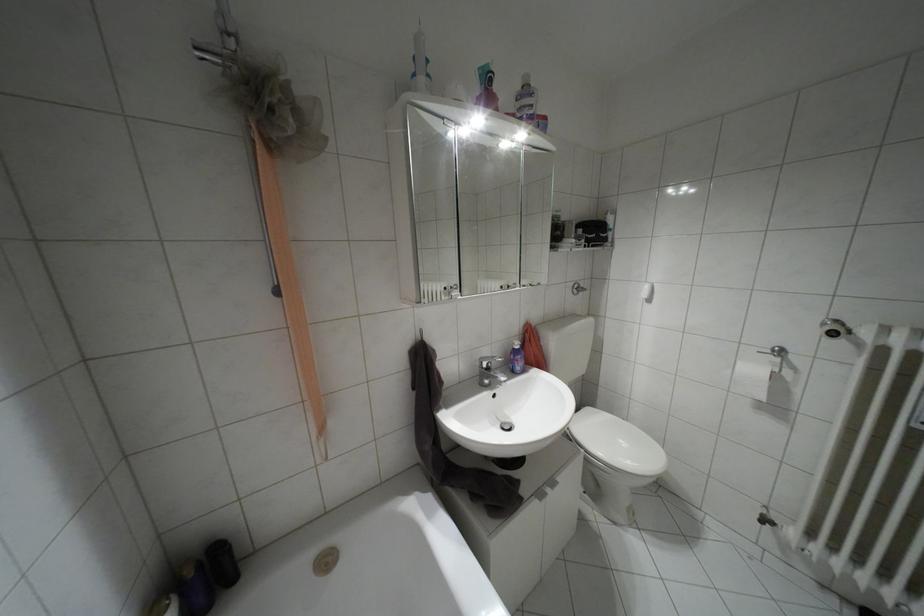
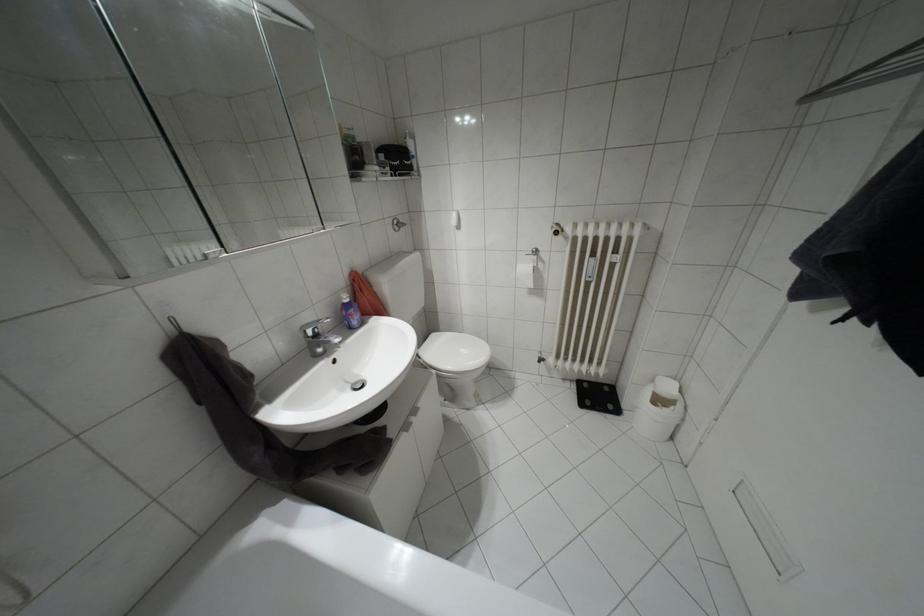
Find the pixel in the second image that matches point (517, 346) in the first image.

(346, 300)